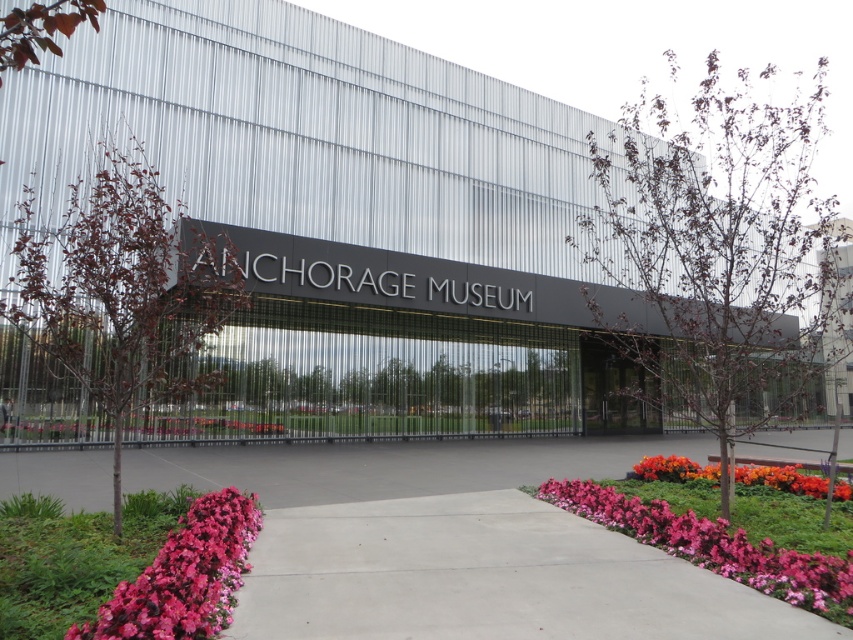
Between point (630, 371) and point (751, 483), which one is positioned in front?

Positioned in front is point (751, 483).

Can you confirm if black glass doors at center is thinner than orange matte flower at lower right?

No, black glass doors at center is not thinner than orange matte flower at lower right.

Describe the element at coordinates (616, 388) in the screenshot. I see `black glass doors at center` at that location.

Where is `black glass doors at center`? Image resolution: width=853 pixels, height=640 pixels. black glass doors at center is located at coordinates (616, 388).

Can you confirm if pink matte flowers at lower left is taller than orange matte flower at lower right?

Yes.

How much distance is there between pink matte flowers at lower left and orange matte flower at lower right?

6.48 meters

At what (x,y) coordinates should I click in order to perform the action: click on pink matte flowers at lower left. Please return your answer as a coordinate pair (x, y). The width and height of the screenshot is (853, 640). Looking at the image, I should click on (184, 577).

Where is `concrete at center`? Image resolution: width=853 pixels, height=640 pixels. concrete at center is located at coordinates (457, 544).